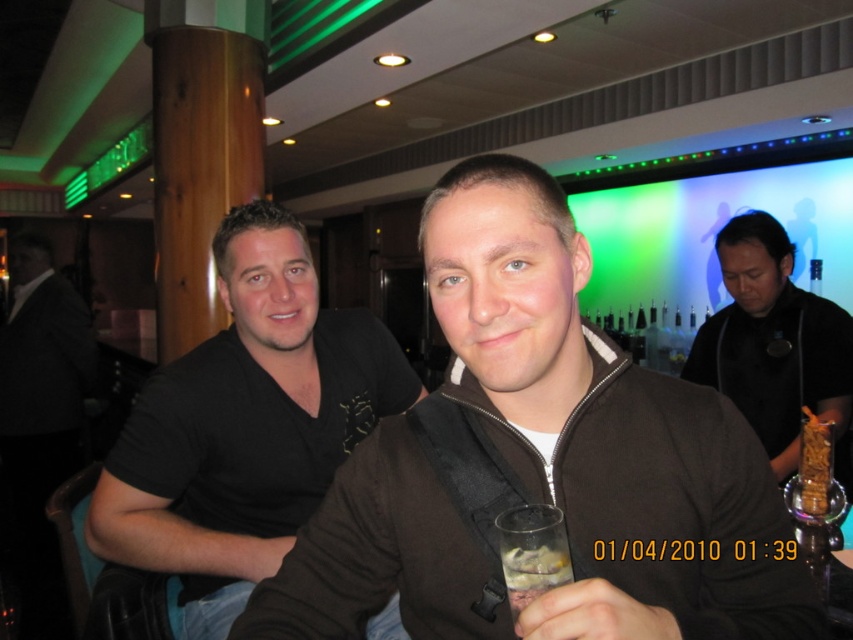
You are a photographer trying to capture the scene. You notice the black matte shirt at right and the clear glass at lower center. Which object should you focus on if you want to capture the larger one in your shot?

The black matte shirt at right is bigger than the clear glass at lower center, so you should focus on the black matte shirt at right to capture the larger object.